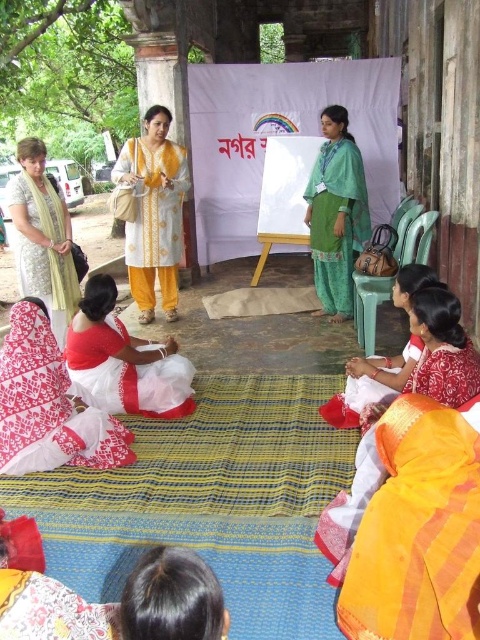
Is white cotton kurta at center thinner than white cotton saree at lower right?

No.

Does point (135, 301) lie behind point (350, 394)?

Yes, point (135, 301) is farther from viewer.

Where is `white cotton kurta at center`? This screenshot has height=640, width=480. white cotton kurta at center is located at coordinates (154, 212).

The image size is (480, 640). What are the coordinates of `white cotton kurta at center` in the screenshot? It's located at (154, 212).

Between orange silk sari at lower right and white cotton saree at lower right, which one has more height?

With more height is white cotton saree at lower right.

Who is more forward, (448, 538) or (402, 300)?

Point (448, 538) is in front.

Which is behind, point (381, 536) or point (348, 378)?

The point (348, 378) is behind.

Identify the location of orange silk sari at lower right. Image resolution: width=480 pixels, height=640 pixels. (418, 531).

Can you confirm if white printed saree at lower left is wider than green cotton kurta at center?

Yes.

Is point (35, 344) behind point (338, 186)?

No, it is not.

This screenshot has width=480, height=640. I want to click on white printed saree at lower left, so click(48, 404).